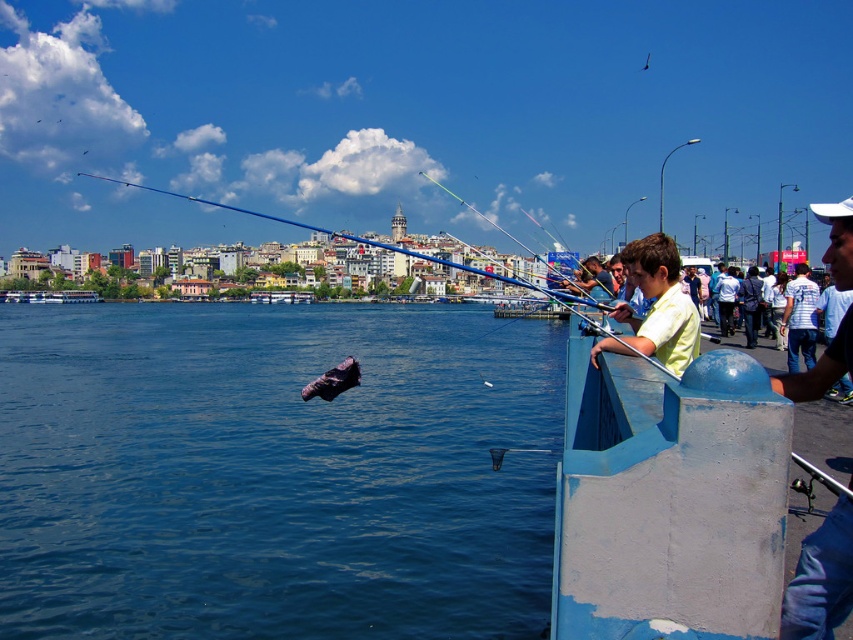
You are standing at the camera position and want to hand a fishing rod to the person wearing the yellow matte shirt at center. Can you reach them directly without moving from your current position?

The yellow matte shirt at center and camera are 84.34 meters apart from each other, so you cannot reach them directly without moving from your current position.

You are standing on the pier and see the yellow matte shirt at center and the white plastic boat at left. Which object is closer to you?

The yellow matte shirt at center is closer to you because it is in front of the white plastic boat at left.